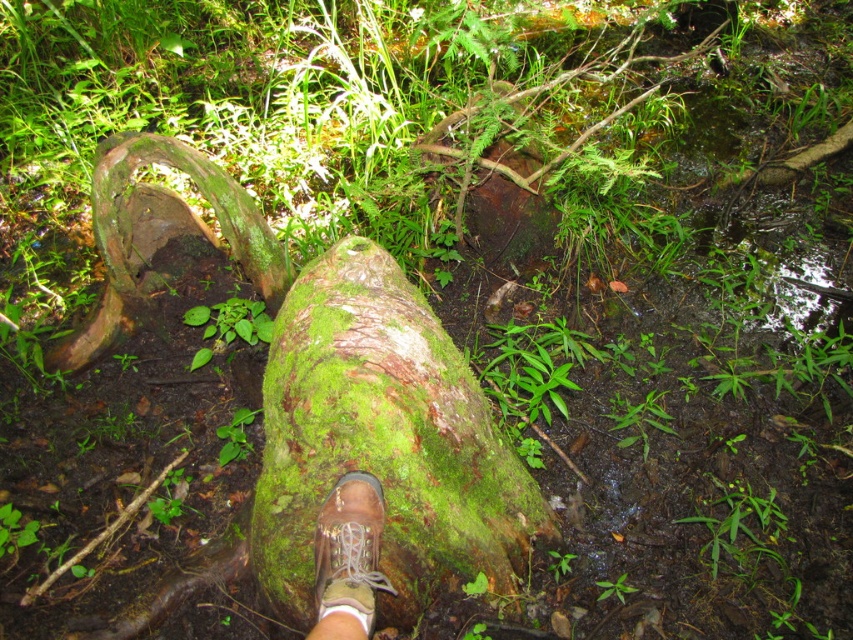
Does green mossy log at center appear over brown leather boot at center?

Yes, green mossy log at center is above brown leather boot at center.

Can you confirm if green mossy log at center is positioned to the left of brown leather boot at center?

Incorrect, green mossy log at center is not on the left side of brown leather boot at center.

Which is in front, point (433, 456) or point (329, 604)?

Point (329, 604)

This screenshot has height=640, width=853. I want to click on green mossy log at center, so click(x=381, y=442).